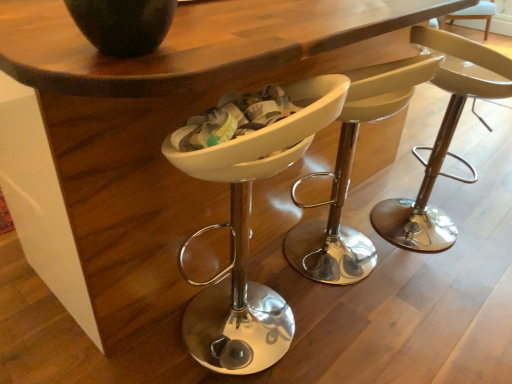
Locate an element on the screen. The height and width of the screenshot is (384, 512). vacant area located to the right-hand side of matte black vase at upper left is located at coordinates (221, 46).